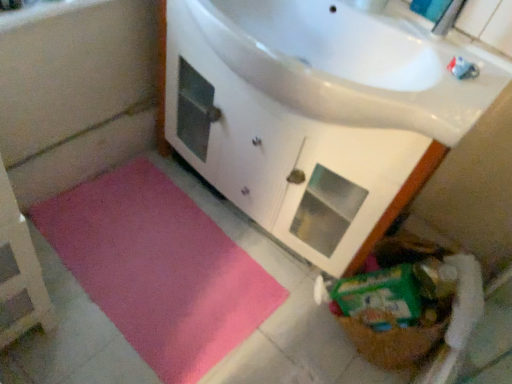
The height and width of the screenshot is (384, 512). I want to click on free space below pink plush bath mat at lower left (from a real-world perspective), so click(x=157, y=254).